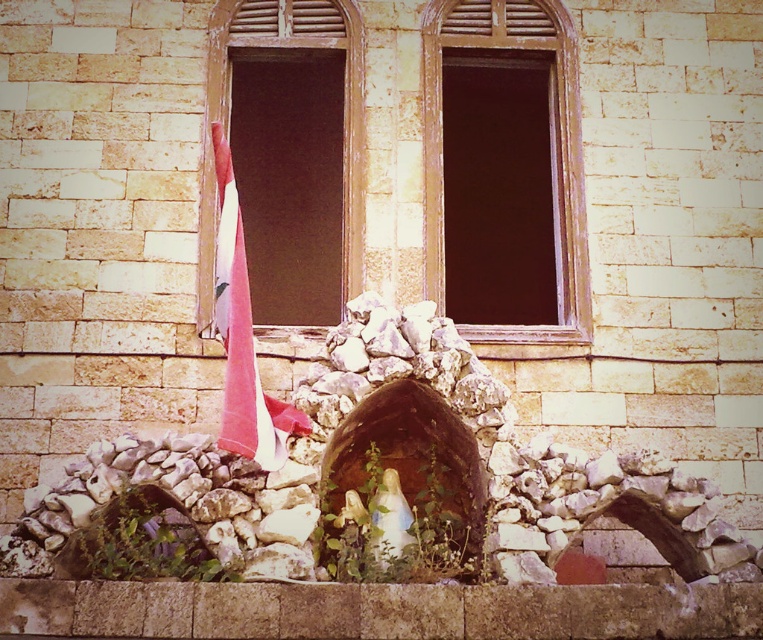
You are standing in front of the building and want to place a small flowerpot between the wooden frame at center and the pink fabric umbrella at left. Based on their sizes, which object should the flowerpot be closer to?

The wooden frame at center is much taller than the pink fabric umbrella at left, so the flowerpot should be placed closer to the pink fabric umbrella at left to balance their sizes.